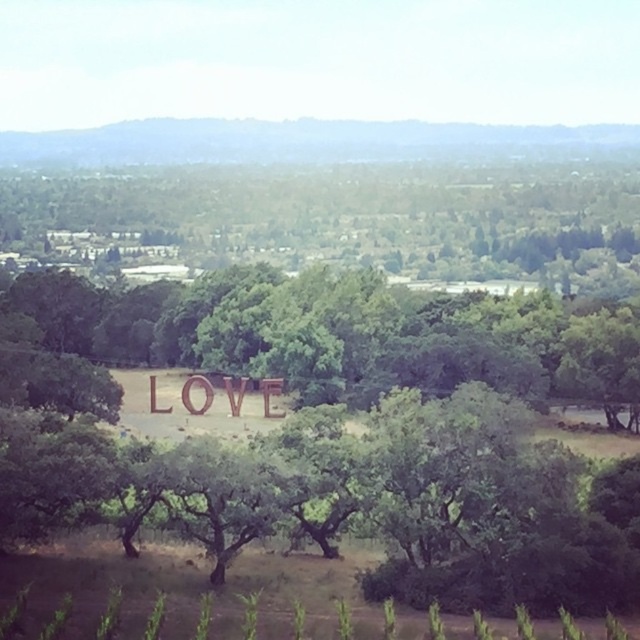
You are planning to take a photo of the wooden sign at center and the green leafy tree at center. Based on their positions, will the tree block the view of the sign in the photo?

The green leafy tree at center is above the wooden sign at center, so the tree will not block the view of the sign in the photo since it is positioned above it.

Looking at this image, you are planning to take a photo of the wooden sign at center and want to ensure the green leafy tree at center is visible in the background. Based on their sizes, will the tree appear larger or smaller than the sign in the photo?

The green leafy tree at center has a larger size compared to the wooden sign at center, so in the photo, the tree will appear larger than the wooden sign at center.